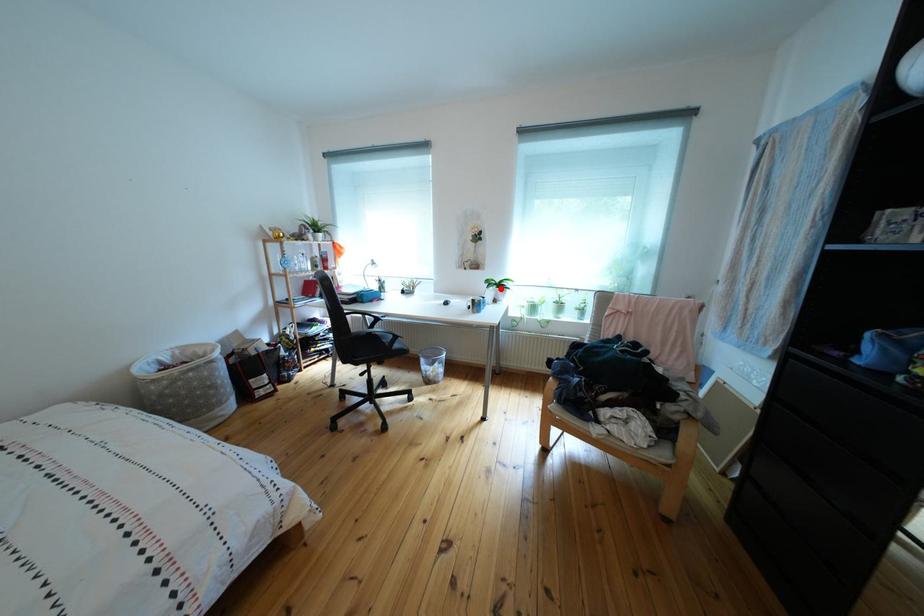
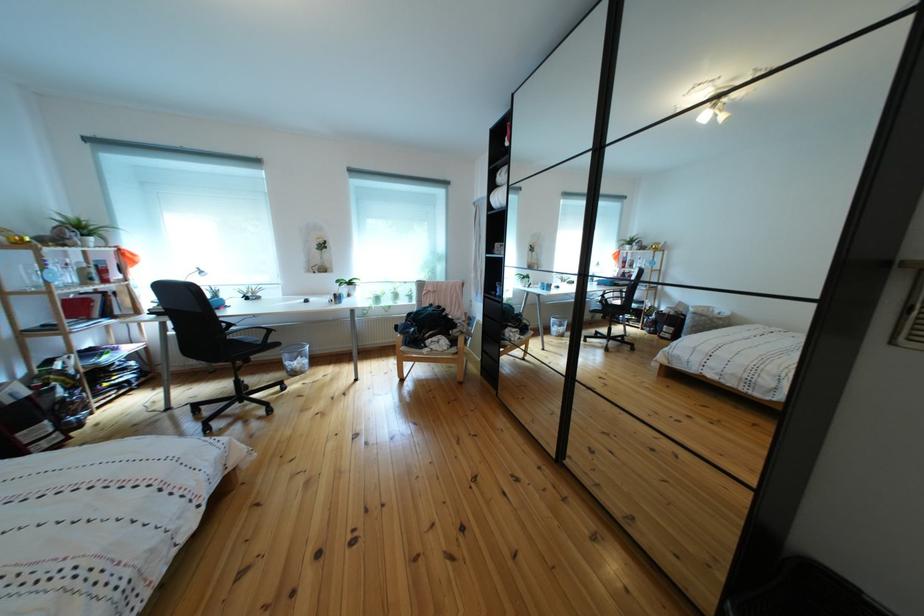
Where in the second image is the point corresponding to the highlighted location from the first image?

(351, 288)